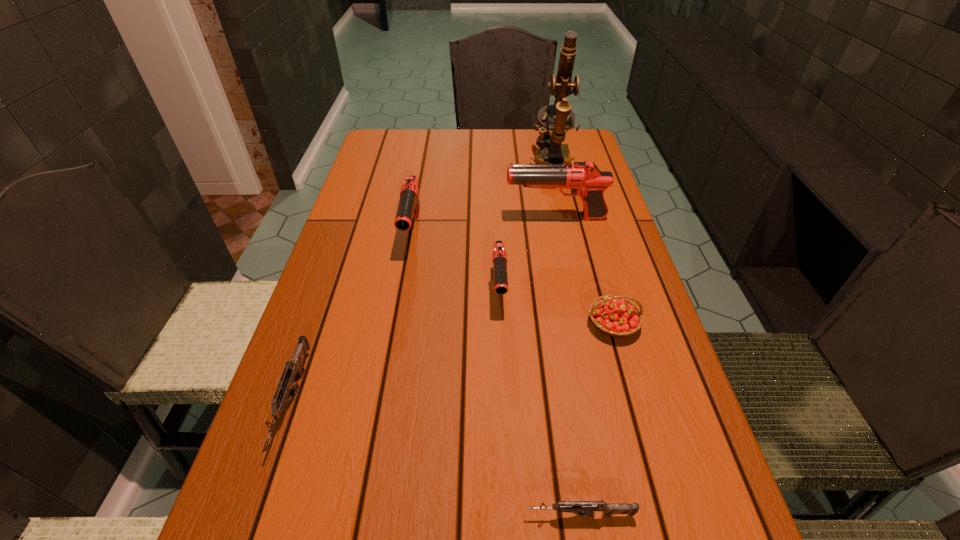
This screenshot has width=960, height=540. Find the location of `the tallest object`. the tallest object is located at coordinates (553, 130).

You are a GUI agent. You are given a task and a screenshot of the screen. Output one action in this format:
    pyautogui.click(x=<x>, y=<y>)
    Task: Click on the farthest object
    The height and width of the screenshot is (540, 960).
    Given the screenshot: What is the action you would take?
    pyautogui.click(x=553, y=130)

Where is `the tallest gun`? The height and width of the screenshot is (540, 960). the tallest gun is located at coordinates (584, 178).

Where is `the biggest black gun`? The height and width of the screenshot is (540, 960). the biggest black gun is located at coordinates (584, 178).

Identify the location of the fourth shortest gun. The image size is (960, 540). (408, 208).

Locate an element on the screen. This screenshot has width=960, height=540. the leftmost black gun is located at coordinates (408, 208).

At what (x,y) coordinates should I click in order to perform the action: click on the third nearest gun. Please return your answer as a coordinate pair (x, y). This screenshot has height=540, width=960. Looking at the image, I should click on (499, 256).

Where is `the smallest black gun`? the smallest black gun is located at coordinates (499, 256).

Where is `brown strawberry`? brown strawberry is located at coordinates (616, 316).

At what (x,y) coordinates should I click in order to perform the action: click on strawberry. Please return your answer as a coordinate pair (x, y). This screenshot has height=540, width=960. Looking at the image, I should click on (616, 316).